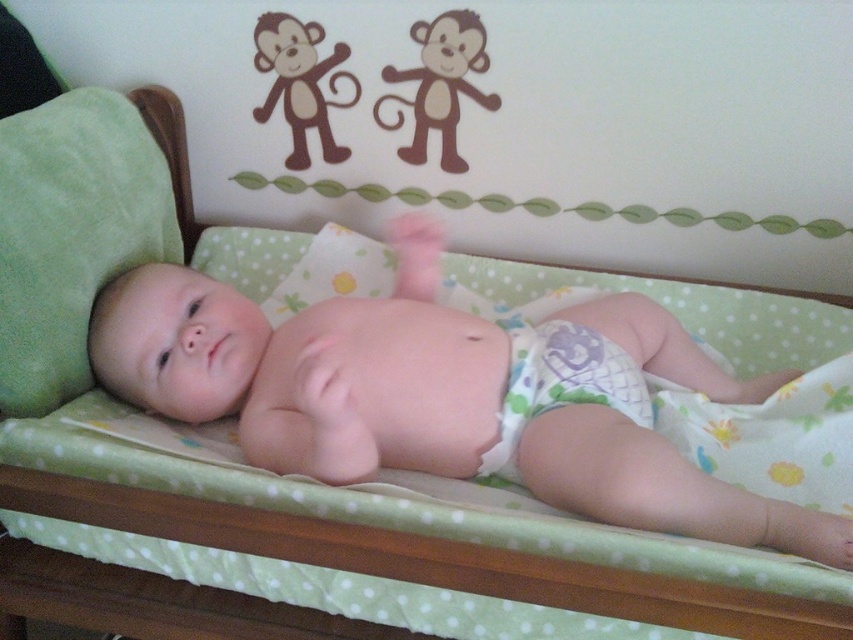
You are a photographer standing at a safe distance from the crib to avoid disturbing the baby. You want to take a photo of the point at coordinates point (345, 385). What is the minimum distance you need to maintain to ensure the camera can capture the entire scene without cropping the point?

The minimum distance you need to maintain is 30.74 inches to ensure the camera can capture the entire scene without cropping the point point (345, 385).

You are a parent holding a baby wipe that is 8 inches long. You want to clean the smooth white diaper at center. Can you reach the diaper without moving closer? Please explain.

The smooth white diaper at center is 30.25 inches away from the viewer. Since the baby wipe is only 8 inches long, you cannot reach the diaper without moving closer. You need to get closer to the diaper to use the baby wipe effectively.

You are a parent checking your baby in the crib. You notice the smooth white diaper at center and the printed fabric diaper at center. Which diaper is closer to the baby?

The smooth white diaper at center is closer to the baby because it is positioned above the printed fabric diaper at center.